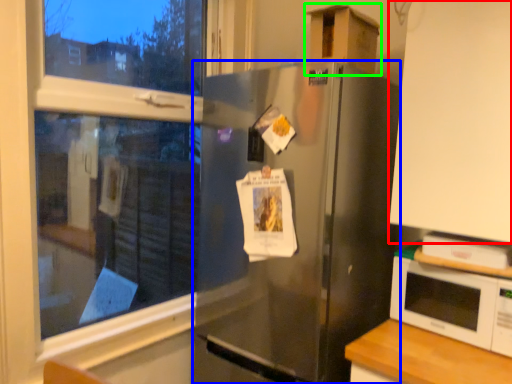
Question: Which is farther away from cabinetry (highlighted by a red box)? refrigerator (highlighted by a blue box) or cardboard box (highlighted by a green box)?

Choices:
 (A) refrigerator
 (B) cardboard box

Answer: (B)